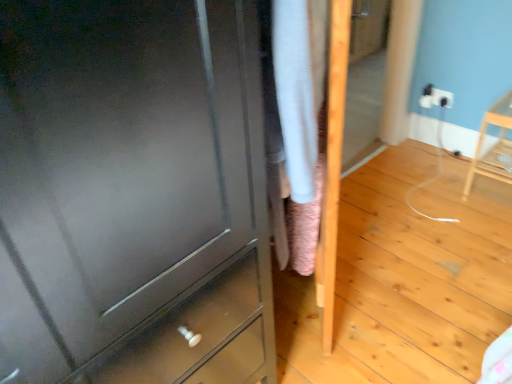
You are a GUI agent. You are given a task and a screenshot of the screen. Output one action in this format:
    pyautogui.click(x=<x>, y=<y>)
    Task: Click on the vacant region under light wood chair at right (from a real-world perspective)
    Image resolution: width=512 pixels, height=384 pixels.
    Given the screenshot: What is the action you would take?
    pyautogui.click(x=493, y=192)